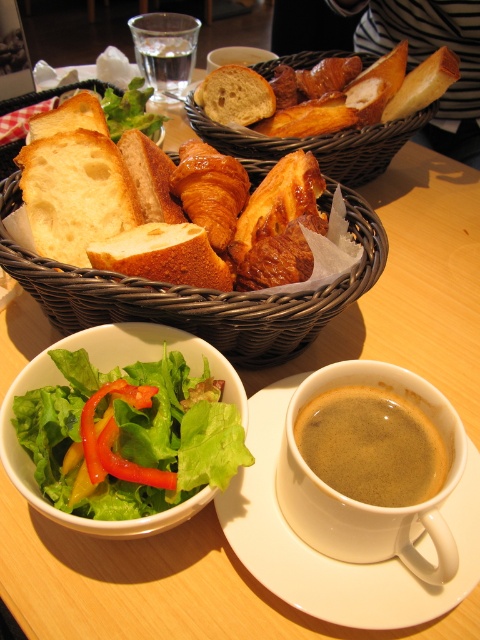
You are arranging a picnic basket and need to know the spatial relationship between the white matte bread at center and the red glossy pepper at lower left. Which item is positioned higher in the image?

The white matte bread at center is above the red glossy pepper at lower left, so it is positioned higher in the image.

You are arranging a picnic basket and need to know which item is wider to fit properly. Which is wider between the white matte bread at center and the red glossy pepper at lower left?

The white matte bread at center is wider than the red glossy pepper at lower left according to the description.

You are sitting at the table and want to reach both the salad bowl and the coffee cup. Which object is closer to you, the salad bowl at point (108, 257) or the coffee cup at point (94, 400)?

The coffee cup at point (94, 400) is closer because point (108, 257) is behind point (94, 400).